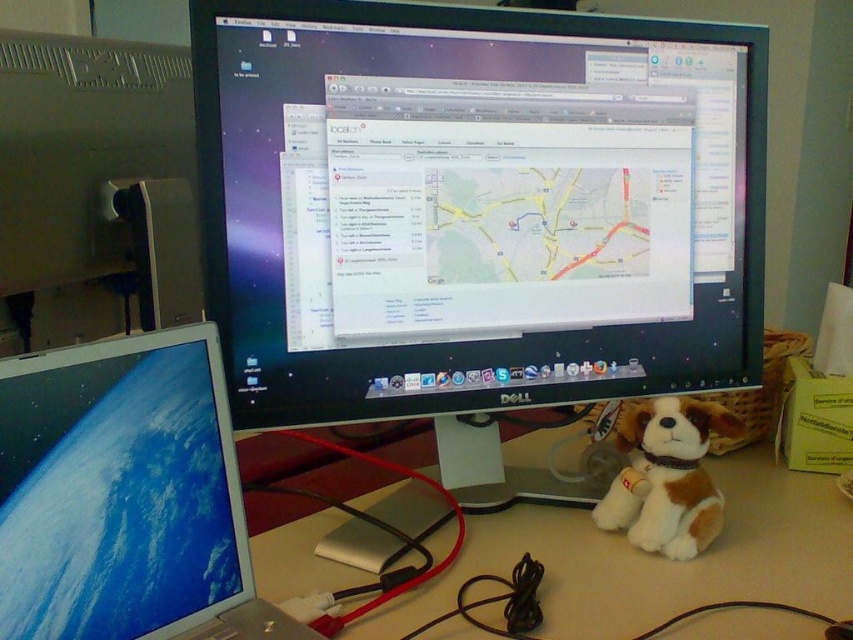
You are organizing a desk and need to place a new keyboard that requires 20 inches of space. Given the black glossy monitor at center and the matte gray desktop at left, which object can accommodate the keyboard based on their sizes?

The black glossy monitor at center has a larger size compared to the matte gray desktop at left, so the keyboard can be placed on the matte gray desktop at left since it has sufficient space.

You are setting up a new desk arrangement and want to place a tall plant between the black glossy monitor at center and the matte gray desktop at left. Considering their heights, which object should the plant be placed closer to?

The black glossy monitor at center is much taller than the matte gray desktop at left, so the plant should be placed closer to the matte gray desktop at left to maintain visual balance.